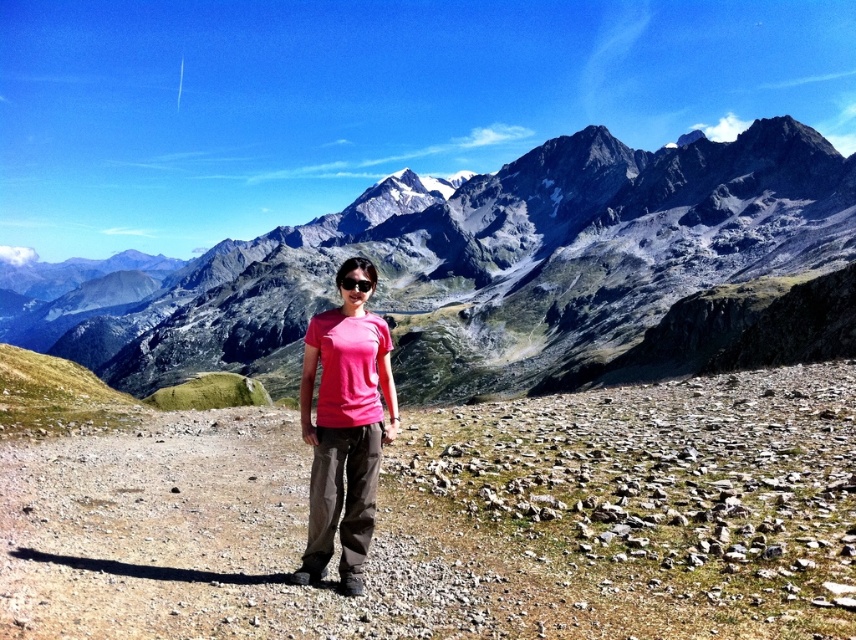
Question: Is green grassy hillside at left above matte black goggles at center?

Choices:
 (A) no
 (B) yes

Answer: (A)

Question: Which object is the farthest from the pink fabric shirt at center?

Choices:
 (A) matte black goggles at center
 (B) rocky gray mountain range at center
 (C) green grassy hillside at left

Answer: (B)

Question: Is rocky gray mountain range at center positioned at the back of pink fabric shirt at center?

Choices:
 (A) no
 (B) yes

Answer: (B)

Question: Is green grassy hillside at left further to the viewer compared to matte black goggles at center?

Choices:
 (A) yes
 (B) no

Answer: (A)

Question: Which is farther from the green grassy hillside at left?

Choices:
 (A) matte black goggles at center
 (B) rocky gray mountain range at center
 (C) pink fabric shirt at center

Answer: (B)

Question: Among these objects, which one is nearest to the camera?

Choices:
 (A) matte black goggles at center
 (B) green grassy hillside at left

Answer: (A)